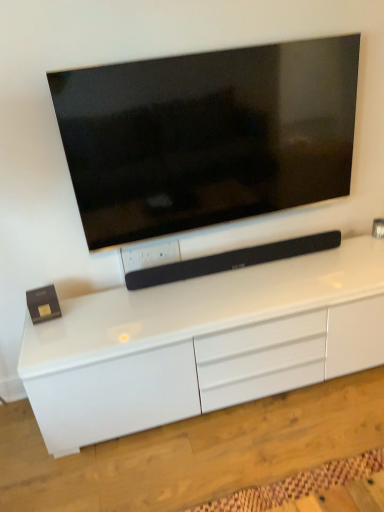
Question: From a real-world perspective, is matte black tv at upper center beneath white glossy cabinet at center?

Choices:
 (A) no
 (B) yes

Answer: (A)

Question: Is matte black tv at upper center far from white glossy cabinet at center?

Choices:
 (A) no
 (B) yes

Answer: (A)

Question: Is white glossy cabinet at center at the back of matte black tv at upper center?

Choices:
 (A) no
 (B) yes

Answer: (A)

Question: Considering the relative positions of matte black tv at upper center and white glossy cabinet at center in the image provided, is matte black tv at upper center to the right of white glossy cabinet at center from the viewer's perspective?

Choices:
 (A) yes
 (B) no

Answer: (B)

Question: Is the position of matte black tv at upper center less distant than that of white glossy cabinet at center?

Choices:
 (A) no
 (B) yes

Answer: (A)

Question: From the image's perspective, relative to black matte soundbar at center, is matte black tv at upper center above or below?

Choices:
 (A) below
 (B) above

Answer: (B)

Question: Looking at their shapes, would you say matte black tv at upper center is wider or thinner than black matte soundbar at center?

Choices:
 (A) wide
 (B) thin

Answer: (B)

Question: In terms of height, does matte black tv at upper center look taller or shorter compared to black matte soundbar at center?

Choices:
 (A) tall
 (B) short

Answer: (A)

Question: From a real-world perspective, is matte black tv at upper center above or below black matte soundbar at center?

Choices:
 (A) below
 (B) above

Answer: (B)

Question: Considering the positions of white glossy cabinet at center and black matte soundbar at center in the image, is white glossy cabinet at center taller or shorter than black matte soundbar at center?

Choices:
 (A) tall
 (B) short

Answer: (A)

Question: Is point pyautogui.click(x=173, y=374) positioned closer to the camera than point pyautogui.click(x=205, y=271)?

Choices:
 (A) farther
 (B) closer

Answer: (B)

Question: Is white glossy cabinet at center bigger or smaller than black matte soundbar at center?

Choices:
 (A) big
 (B) small

Answer: (A)

Question: From a real-world perspective, is white glossy cabinet at center positioned above or below black matte soundbar at center?

Choices:
 (A) above
 (B) below

Answer: (B)

Question: From the image's perspective, relative to matte black tv at upper center, is white glossy cabinet at center above or below?

Choices:
 (A) above
 (B) below

Answer: (B)

Question: From their relative heights in the image, would you say white glossy cabinet at center is taller or shorter than matte black tv at upper center?

Choices:
 (A) tall
 (B) short

Answer: (B)